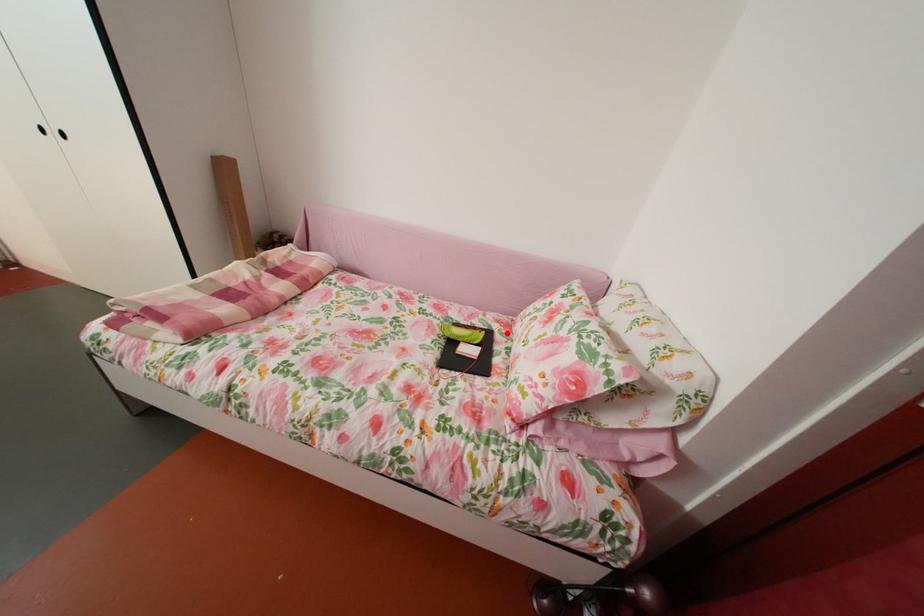
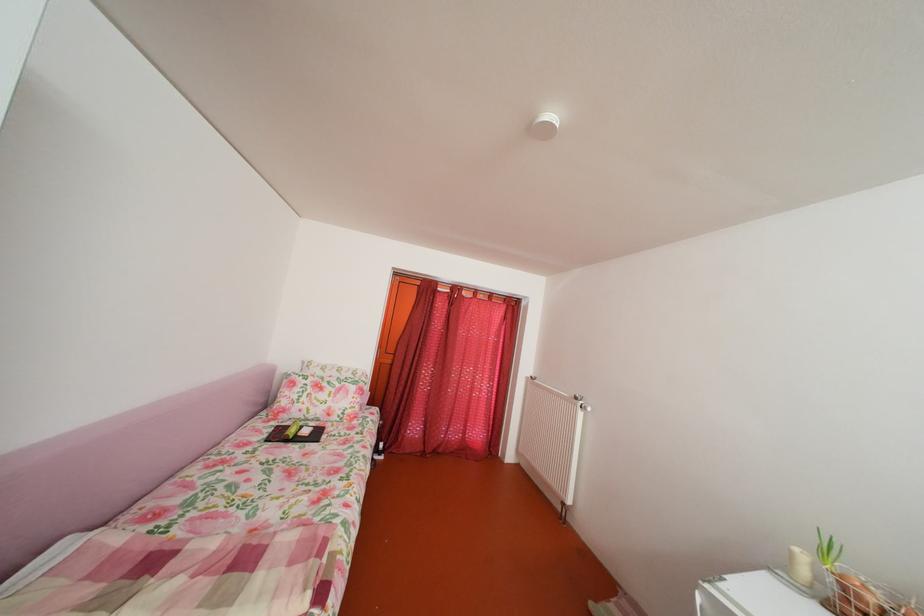
Question: A red point is marked in image1. In image2, is the corresponding 3D point closer to the camera or farther? Reply with the corresponding letter.

Choices:
 (A) The corresponding 3D point is closer.
 (B) The corresponding 3D point is farther.

Answer: (B)